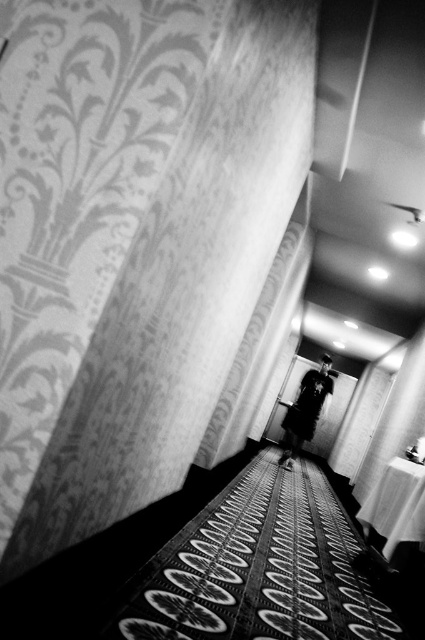
In the scene shown: Does silky white curtain at center have a greater width compared to dark fabric coat at center?

Yes.

Can you confirm if silky white curtain at center is positioned above dark fabric coat at center?

Yes.

Who is more forward, (x=243, y=371) or (x=325, y=387)?

Point (x=243, y=371)

Locate an element on the screen. This screenshot has width=425, height=640. silky white curtain at center is located at coordinates (257, 349).

Between point (396, 376) and point (322, 388), which one is positioned in front?

Point (396, 376) is more forward.

At what (x,y) coordinates should I click in order to perform the action: click on silky white curtain at right. Please return your answer as a coordinate pair (x, y). This screenshot has height=640, width=425. Looking at the image, I should click on (396, 419).

Between silky white curtain at center and silky white curtain at right, which one has less height?

silky white curtain at right

Is silky white curtain at center further to camera compared to silky white curtain at right?

No.

Which is in front, point (269, 324) or point (424, 394)?

Positioned in front is point (424, 394).

I want to click on silky white curtain at center, so click(257, 349).